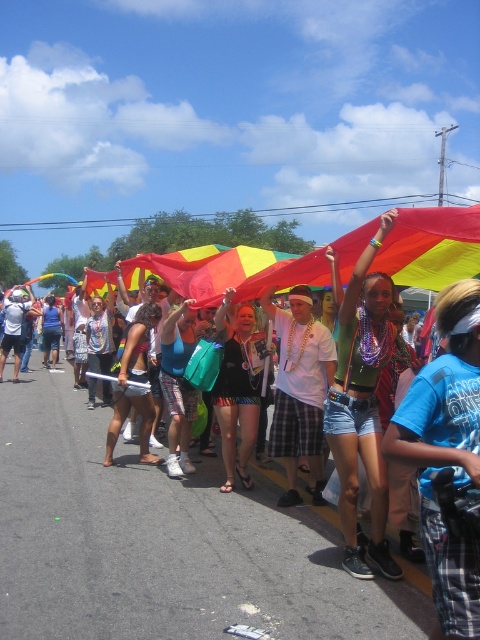
Is point (448, 529) positioned before point (235, 445)?

Yes.

Between point (447, 305) and point (248, 477), which one is positioned behind?

The point (248, 477) is more distant.

This screenshot has height=640, width=480. I want to click on blue cotton shirt at center, so click(447, 460).

Is green fabric top at center shorter than white matte t-shirt at center?

In fact, green fabric top at center may be taller than white matte t-shirt at center.

Is green fabric top at center smaller than white matte t-shirt at center?

No, green fabric top at center is not smaller than white matte t-shirt at center.

Does point (347, 564) come in front of point (292, 419)?

Yes.

Identify the location of green fabric top at center. (362, 404).

Is blue cotton shirt at center below white matte t-shirt at center?

Incorrect, blue cotton shirt at center is not positioned below white matte t-shirt at center.

Is blue cotton shirt at center to the right of white matte t-shirt at center from the viewer's perspective?

Indeed, blue cotton shirt at center is positioned on the right side of white matte t-shirt at center.

Does point (442, 296) come in front of point (275, 429)?

Yes, point (442, 296) is closer to viewer.

Identify the location of blue cotton shirt at center. (447, 460).